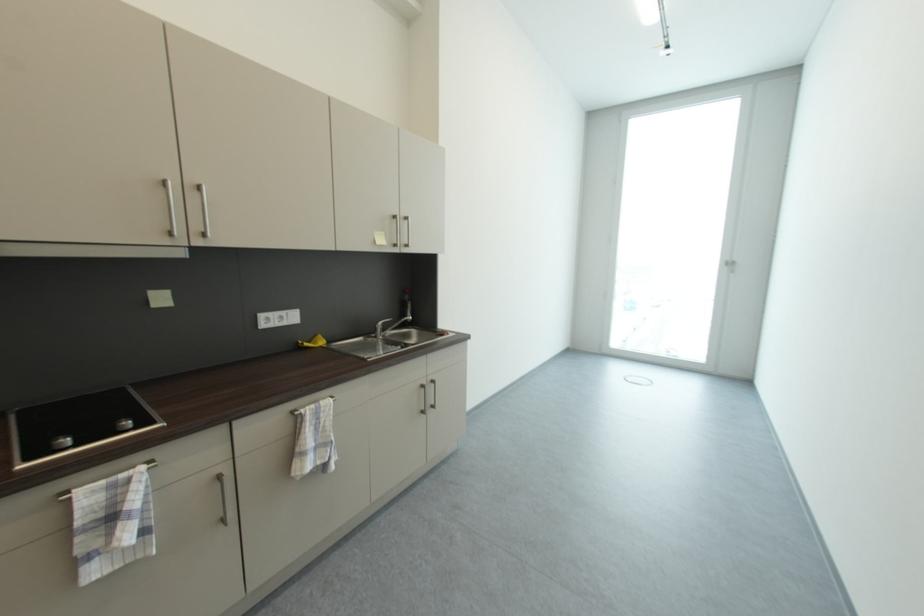
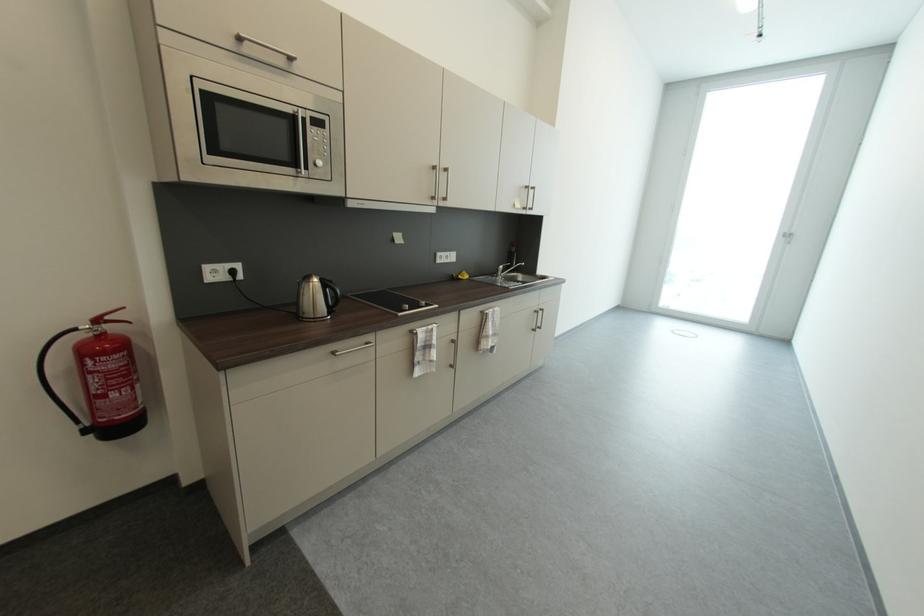
Where in the second image is the point corresponding to (312,346) from the first image?

(467, 278)